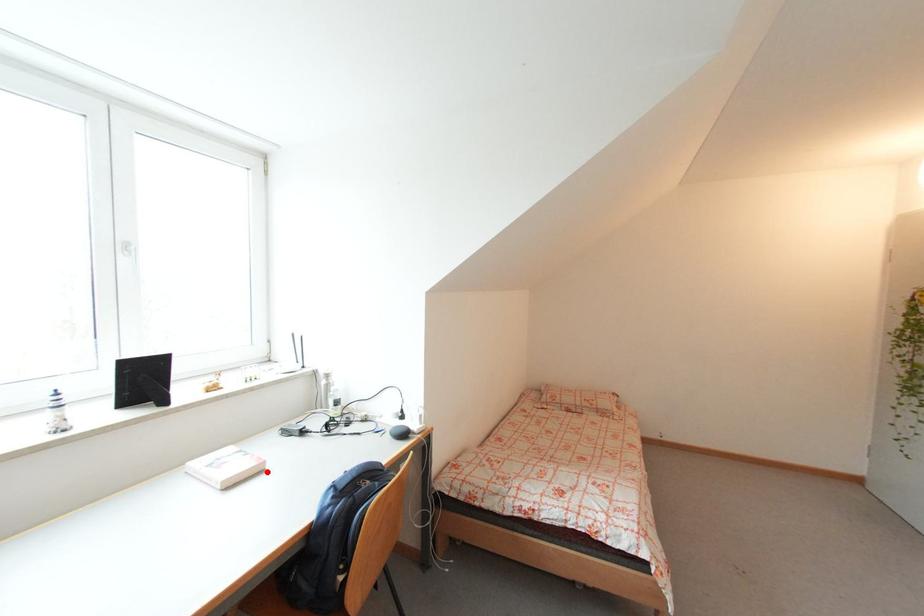
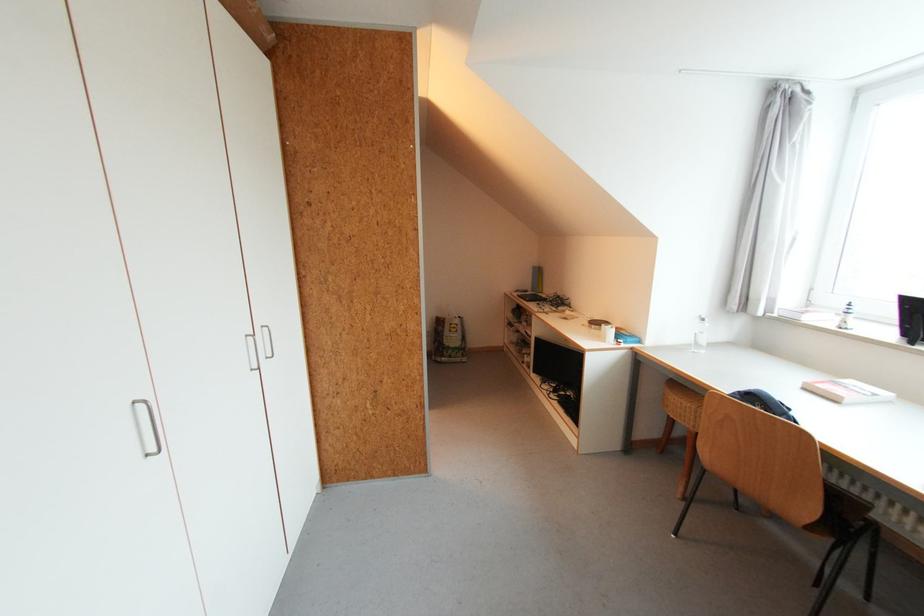
The point at the highlighted location is marked in the first image. Where is the corresponding point in the second image?

(841, 403)